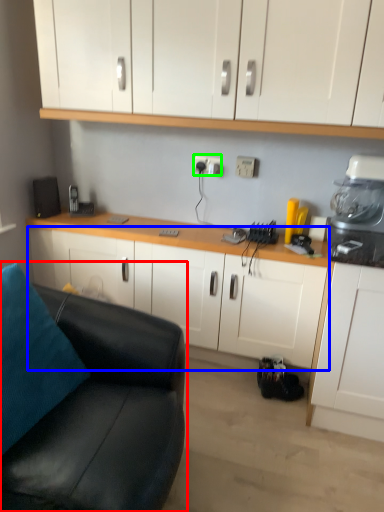
Question: Which object is the closest to the studio couch (highlighted by a red box)? Choose among these: cabinetry (highlighted by a blue box) or electric outlet (highlighted by a green box).

Choices:
 (A) cabinetry
 (B) electric outlet

Answer: (A)